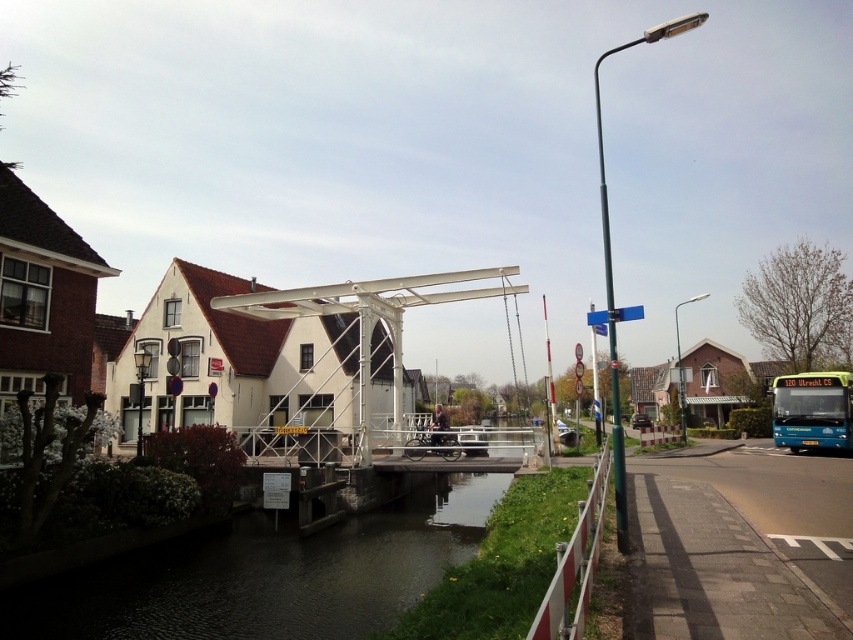
Question: Can you confirm if dark water at center is positioned to the left of teal matte bus at lower right?

Choices:
 (A) no
 (B) yes

Answer: (B)

Question: Is metallic pole at upper right thinner than matte metal lamp post at center-left?

Choices:
 (A) no
 (B) yes

Answer: (A)

Question: Is metallic pole at right to the right of matte metal lamp post at center-left from the viewer's perspective?

Choices:
 (A) no
 (B) yes

Answer: (B)

Question: Which is farther from the teal matte bus at lower right?

Choices:
 (A) metallic pole at right
 (B) matte metal lamp post at center-left
 (C) metallic pole at upper right
 (D) dark water at center

Answer: (B)

Question: Considering the real-world distances, which object is closest to the dark water at center?

Choices:
 (A) metallic pole at right
 (B) teal matte bus at lower right

Answer: (A)

Question: Which point is farther from the camera taking this photo?

Choices:
 (A) (683, 428)
 (B) (811, 380)
 (C) (129, 586)
 (D) (138, 348)

Answer: (D)